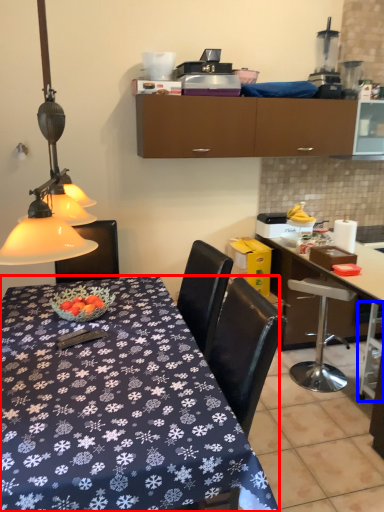
Question: Which object is closer to the camera taking this photo, desk (highlighted by a red box) or bar stool (highlighted by a blue box)?

Choices:
 (A) desk
 (B) bar stool

Answer: (A)